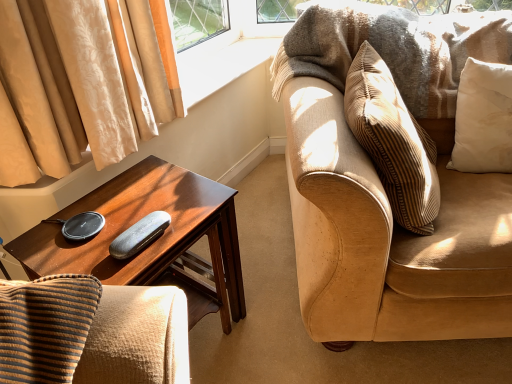
Question: Is shiny brown wood desk at left completely or partially inside suede couch at right?

Choices:
 (A) yes
 (B) no

Answer: (B)

Question: Considering the relative sizes of suede couch at right and shiny brown wood desk at left in the image provided, is suede couch at right taller than shiny brown wood desk at left?

Choices:
 (A) yes
 (B) no

Answer: (A)

Question: Does suede couch at right have a lesser width compared to shiny brown wood desk at left?

Choices:
 (A) no
 (B) yes

Answer: (A)

Question: Considering the relative sizes of suede couch at right and shiny brown wood desk at left in the image provided, is suede couch at right wider than shiny brown wood desk at left?

Choices:
 (A) yes
 (B) no

Answer: (A)

Question: From a real-world perspective, is suede couch at right positioned under shiny brown wood desk at left based on gravity?

Choices:
 (A) yes
 (B) no

Answer: (B)

Question: In the image, is black textured case at center positioned in front of or behind white cotton pillow at upper right?

Choices:
 (A) front
 (B) behind

Answer: (A)

Question: Is black textured case at center taller or shorter than white cotton pillow at upper right?

Choices:
 (A) tall
 (B) short

Answer: (B)

Question: In terms of size, does black textured case at center appear bigger or smaller than white cotton pillow at upper right?

Choices:
 (A) small
 (B) big

Answer: (A)

Question: Visually, is black textured case at center positioned to the left or to the right of white cotton pillow at upper right?

Choices:
 (A) right
 (B) left

Answer: (B)

Question: From a real-world perspective, relative to suede couch at right, is shiny brown wood desk at left vertically above or below?

Choices:
 (A) below
 (B) above

Answer: (A)

Question: Does point (154, 200) appear closer or farther from the camera than point (322, 211)?

Choices:
 (A) closer
 (B) farther

Answer: (B)

Question: Is shiny brown wood desk at left to the left or to the right of suede couch at right in the image?

Choices:
 (A) left
 (B) right

Answer: (A)

Question: From their relative heights in the image, would you say shiny brown wood desk at left is taller or shorter than suede couch at right?

Choices:
 (A) short
 (B) tall

Answer: (A)

Question: Visually, is shiny brown wood desk at left positioned to the left or to the right of black textured case at center?

Choices:
 (A) left
 (B) right

Answer: (A)

Question: In the image, is shiny brown wood desk at left positioned in front of or behind black textured case at center?

Choices:
 (A) behind
 (B) front

Answer: (B)